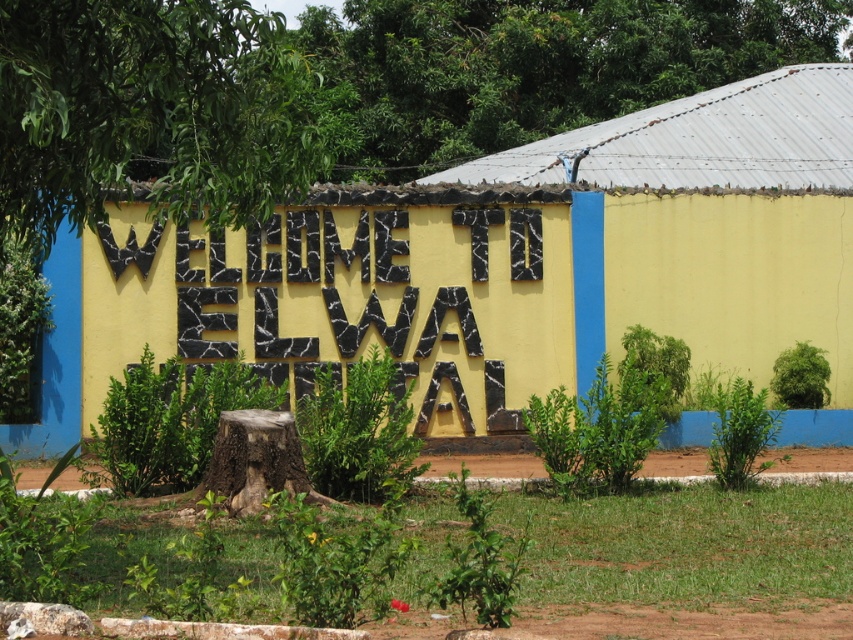
Question: Can you confirm if yellow painted wall at center is smaller than black stone letters at center?

Choices:
 (A) yes
 (B) no

Answer: (B)

Question: Can you confirm if yellow painted wall at center is smaller than black stone letters at center?

Choices:
 (A) no
 (B) yes

Answer: (A)

Question: Is yellow painted wall at center below black stone letters at center?

Choices:
 (A) no
 (B) yes

Answer: (A)

Question: Which object is the farthest from the yellow painted wall at center?

Choices:
 (A) brown rough tree stump at center
 (B) black stone letters at center

Answer: (A)

Question: Which point is farther from the camera taking this photo?

Choices:
 (A) (376, 339)
 (B) (750, 280)
 (C) (231, 410)

Answer: (B)

Question: Which of the following is the farthest from the observer?

Choices:
 (A) (251, 502)
 (B) (160, 346)
 (C) (577, 289)

Answer: (C)